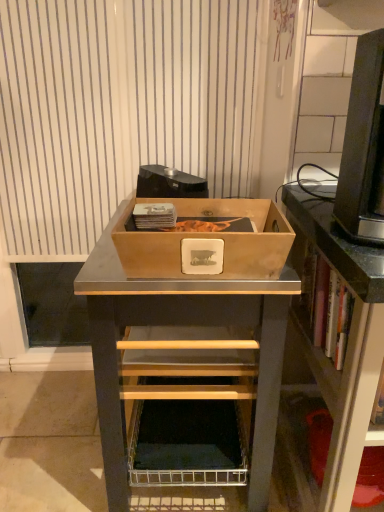
What is the approximate width of black plastic desktop computer at upper right?

It is 27.84 centimeters.

The width and height of the screenshot is (384, 512). What do you see at coordinates (364, 146) in the screenshot? I see `black plastic desktop computer at upper right` at bounding box center [364, 146].

Describe the element at coordinates (209, 238) in the screenshot. I see `wooden box at center` at that location.

Find the location of `wooden box at center`. wooden box at center is located at coordinates pos(209,238).

Identify the location of black plastic desktop computer at upper right. The height and width of the screenshot is (512, 384). pos(364,146).

Find the location of a particular element. The width and height of the screenshot is (384, 512). curtain behind the wooden box at center is located at coordinates (120, 109).

Which is behind, white striped curtain at upper center or wooden box at center?

white striped curtain at upper center is further from the camera.

Is white striped curtain at upper center next to wooden box at center?

No.

Is white striped curtain at upper center surrounding wooden box at center?

No, wooden box at center is not surrounded by white striped curtain at upper center.

Is black plastic desktop computer at upper right turned away from wooden box at center?

black plastic desktop computer at upper right is not turned away from wooden box at center.

Based on the photo, is black plastic desktop computer at upper right far from wooden box at center?

That's not correct — black plastic desktop computer at upper right is a little close to wooden box at center.

From a real-world perspective, does black plastic desktop computer at upper right stand above wooden box at center?

Yes, from a real-world perspective, black plastic desktop computer at upper right is over wooden box at center

Between black plastic desktop computer at upper right and wooden box at center, which one has larger size?

With larger size is wooden box at center.

Who is more distant, wooden box at center or white striped curtain at upper center?

white striped curtain at upper center is behind.

Does point (232, 287) lie behind point (197, 14)?

No, (232, 287) is closer to viewer.

Is wooden box at center not close to white striped curtain at upper center?

wooden box at center is near white striped curtain at upper center, not far away.

Which object is thinner, wooden box at center or white striped curtain at upper center?

Thinner between the two is white striped curtain at upper center.

From the image's perspective, is wooden box at center above black plastic desktop computer at upper right?

No, from the image's perspective, wooden box at center is not on top of black plastic desktop computer at upper right.

This screenshot has height=512, width=384. I want to click on box on the left of black plastic desktop computer at upper right, so (209, 238).

Is wooden box at center to the left or to the right of black plastic desktop computer at upper right in the image?

In the image, wooden box at center appears on the left side of black plastic desktop computer at upper right.

Could you tell me if wooden box at center is turned towards black plastic desktop computer at upper right?

No, wooden box at center is not facing towards black plastic desktop computer at upper right.

Are wooden box at center and wooden box at center located far from each other?

wooden box at center is actually quite close to wooden box at center.

Considering their positions, is wooden box at center located in front of or behind wooden box at center?

Visually, wooden box at center is located behind wooden box at center.

Is wooden box at center not within wooden box at center?

Absolutely, wooden box at center is external to wooden box at center.

Which of these two, wooden box at center or wooden box at center, is smaller?

Smaller between the two is wooden box at center.

Image resolution: width=384 pixels, height=512 pixels. Identify the location of table behind the matte black shelf at right. (190, 320).

Does wooden box at center have a greater width compared to matte black shelf at right?

Yes, wooden box at center is wider than matte black shelf at right.

Between wooden box at center and matte black shelf at right, which one has less height?

wooden box at center is shorter.

From a real-world perspective, which object stands above the other?

black plastic desktop computer at upper right, from a real-world perspective.

Considering the sizes of black plastic desktop computer at upper right and wooden box at center in the image, is black plastic desktop computer at upper right wider or thinner than wooden box at center?

Considering their sizes, black plastic desktop computer at upper right looks slimmer than wooden box at center.

Between black plastic desktop computer at upper right and wooden box at center, which one is positioned behind?

Positioned behind is wooden box at center.

Where is `curtain above the wooden box at center (from the image's perspective)`? The height and width of the screenshot is (512, 384). curtain above the wooden box at center (from the image's perspective) is located at coordinates (120, 109).

Locate an element on the screen. desktop computer on the right of wooden box at center is located at coordinates pos(364,146).

Based on their spatial positions, is matte black shelf at right or wooden box at center closer to wooden box at center?

wooden box at center is closer to wooden box at center.

Looking at the image, which one is located closer to black plastic desktop computer at upper right, white striped curtain at upper center or matte black shelf at right?

matte black shelf at right is closer to black plastic desktop computer at upper right.

Based on their spatial positions, is matte black shelf at right or black plastic desktop computer at upper right further from wooden box at center?

The object further to wooden box at center is black plastic desktop computer at upper right.

When comparing their distances from wooden box at center, does matte black shelf at right or wooden box at center seem further?

The object further to wooden box at center is matte black shelf at right.

Looking at the image, which one is located closer to wooden box at center, wooden box at center or matte black shelf at right?

Among the two, wooden box at center is located nearer to wooden box at center.

Considering their positions, is black plastic desktop computer at upper right positioned further to wooden box at center than white striped curtain at upper center?

Based on the image, white striped curtain at upper center appears to be further to wooden box at center.

Which object lies nearer to the anchor point black plastic desktop computer at upper right, matte black shelf at right or white striped curtain at upper center?

matte black shelf at right lies closer to black plastic desktop computer at upper right than the other object.

Estimate the real-world distances between objects in this image. Which object is closer to white striped curtain at upper center, black plastic desktop computer at upper right or matte black shelf at right?

matte black shelf at right.

This screenshot has height=512, width=384. Find the location of `shelf located between black plastic desktop computer at upper right and white striped curtain at upper center in the depth direction`. shelf located between black plastic desktop computer at upper right and white striped curtain at upper center in the depth direction is located at coordinates (326, 333).

The width and height of the screenshot is (384, 512). What are the coordinates of `table that lies between white striped curtain at upper center and matte black shelf at right from top to bottom` in the screenshot? It's located at (190, 320).

Where is `table between black plastic desktop computer at upper right and white striped curtain at upper center along the z-axis`? The width and height of the screenshot is (384, 512). table between black plastic desktop computer at upper right and white striped curtain at upper center along the z-axis is located at coordinates (190, 320).

The height and width of the screenshot is (512, 384). I want to click on table that lies between black plastic desktop computer at upper right and matte black shelf at right from top to bottom, so click(x=190, y=320).